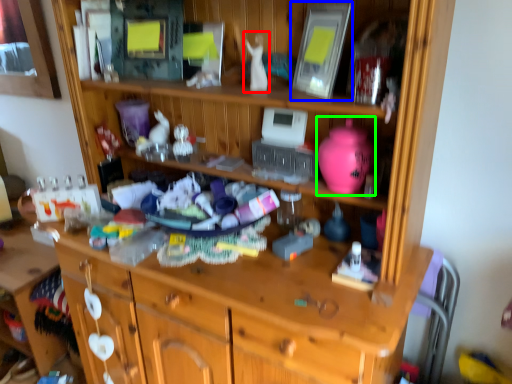
Question: Which object is the farthest from toy (highlighted by a red box)? Choose among these: picture frame (highlighted by a blue box) or toy (highlighted by a green box).

Choices:
 (A) picture frame
 (B) toy

Answer: (B)